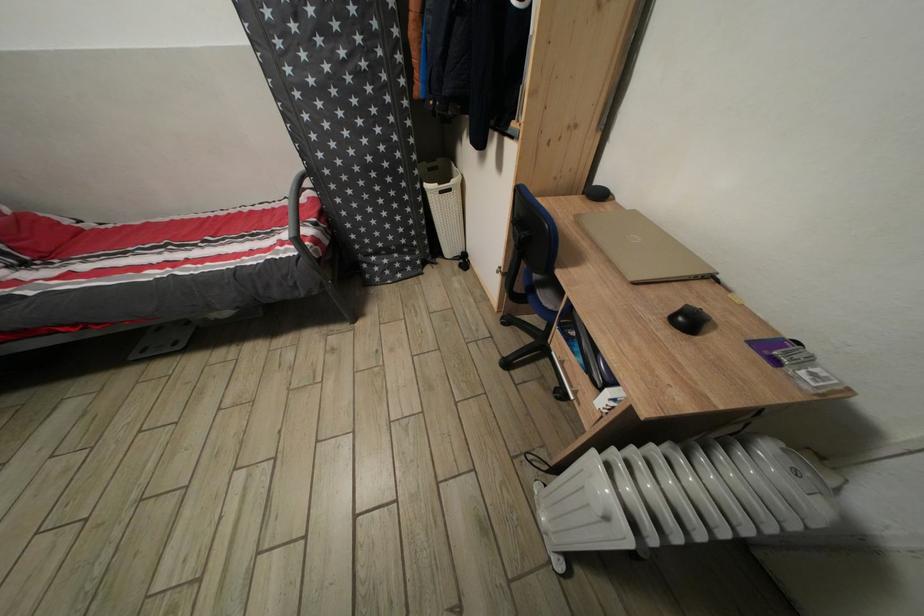
You are a GUI agent. You are given a task and a screenshot of the screen. Output one action in this format:
    pyautogui.click(x=<x>, y=<y>)
    Task: Click on the black computer mouse
    The image size is (924, 616).
    Given the screenshot: What is the action you would take?
    pyautogui.click(x=688, y=320)